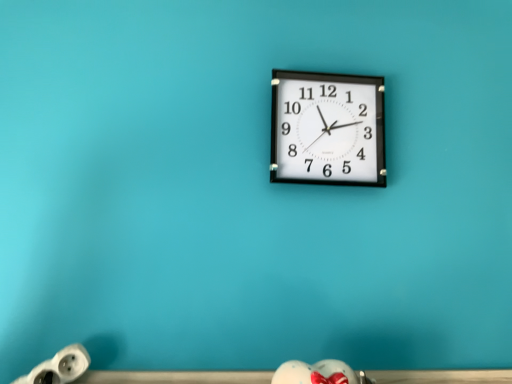
Question: Considering the relative positions of black plastic wall clock at center and white plastic plug at lower left in the image provided, is black plastic wall clock at center to the left or to the right of white plastic plug at lower left?

Choices:
 (A) left
 (B) right

Answer: (B)

Question: Would you say black plastic wall clock at center is inside or outside white plastic plug at lower left?

Choices:
 (A) outside
 (B) inside

Answer: (A)

Question: From a real-world perspective, is black plastic wall clock at center physically located above or below white plastic plug at lower left?

Choices:
 (A) above
 (B) below

Answer: (A)

Question: Is white plastic plug at lower left wider or thinner than black plastic wall clock at center?

Choices:
 (A) wide
 (B) thin

Answer: (A)

Question: Based on their positions, is white plastic plug at lower left located to the left or right of black plastic wall clock at center?

Choices:
 (A) right
 (B) left

Answer: (B)

Question: In terms of height, does white plastic plug at lower left look taller or shorter compared to black plastic wall clock at center?

Choices:
 (A) short
 (B) tall

Answer: (A)

Question: Looking at the image, does white plastic plug at lower left seem bigger or smaller compared to black plastic wall clock at center?

Choices:
 (A) big
 (B) small

Answer: (B)